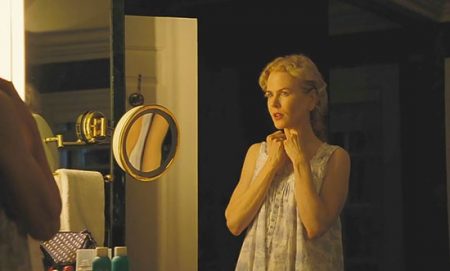
At what (x,y) coordinates should I click in order to perform the action: click on mirror. Please return your answer as a coordinate pair (x, y). This screenshot has height=271, width=450. Looking at the image, I should click on (147, 142).